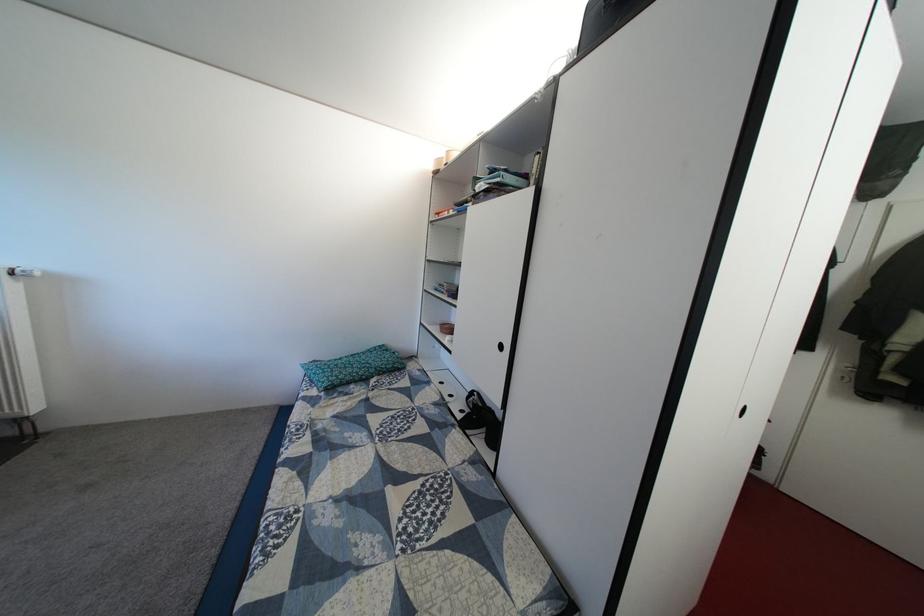
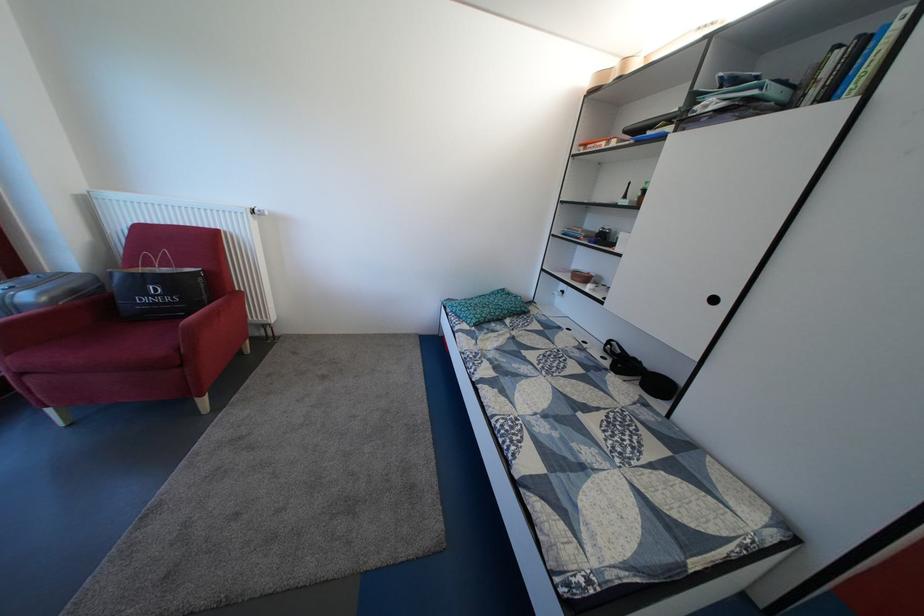
Find the pixel in the second image that matches [357,374] in the first image.

(494, 314)